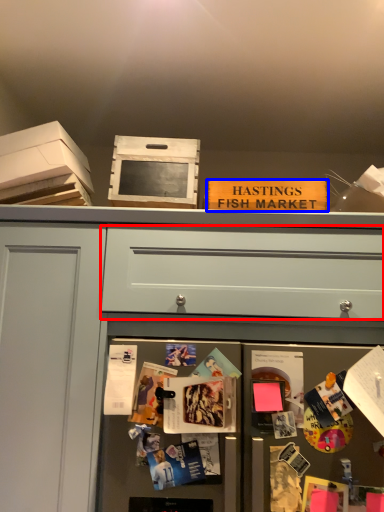
Question: Which of the following is the closest to the observer, drawer (highlighted by a red box) or magazine (highlighted by a blue box)?

Choices:
 (A) drawer
 (B) magazine

Answer: (A)